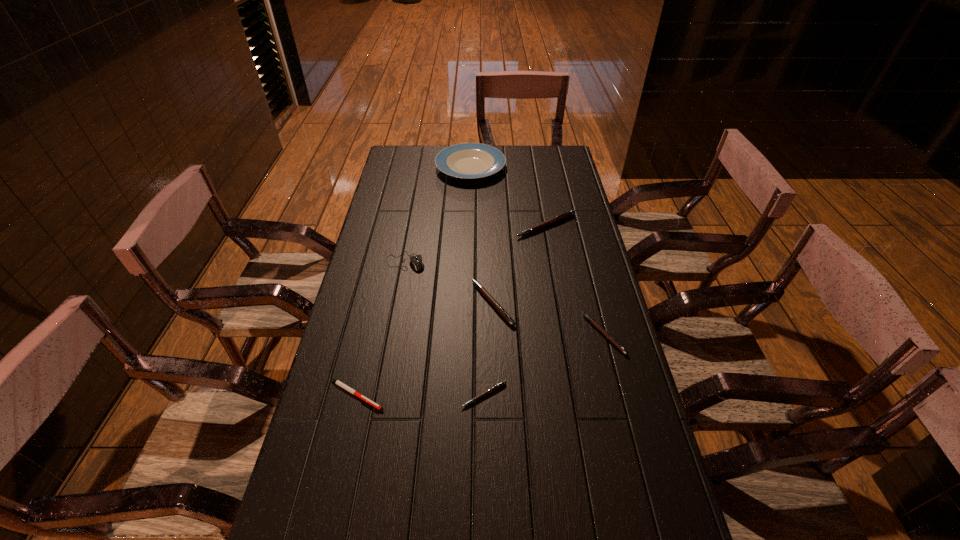
Identify the location of free region located 0.060m at the nib of the smallest pink pen. (484, 432).

The image size is (960, 540). In order to click on vacant space located 0.340m on the clicker of the leftmost pen in this screenshot , I will do `click(520, 395)`.

This screenshot has height=540, width=960. In order to click on object located at the far edge in this screenshot , I will do `click(466, 160)`.

Where is `computer mouse that is at the left edge`? Image resolution: width=960 pixels, height=540 pixels. computer mouse that is at the left edge is located at coordinates (416, 260).

At what (x,y) coordinates should I click in order to perform the action: click on pen that is at the left edge. Please return your answer as a coordinate pair (x, y). The image size is (960, 540). Looking at the image, I should click on (337, 382).

What are the coordinates of `vacant region at the far edge of the desktop` in the screenshot? It's located at (515, 156).

Find the location of a particular element. free space at the left edge of the desktop is located at coordinates (396, 234).

The width and height of the screenshot is (960, 540). Find the location of `free spot at the right edge of the desktop`. free spot at the right edge of the desktop is located at coordinates (592, 272).

At what (x,y) coordinates should I click in order to perform the action: click on vacant area at the far left corner. Please return your answer as a coordinate pair (x, y). This screenshot has height=540, width=960. Looking at the image, I should click on (415, 168).

In order to click on empty space between the white pen and the second biggest pink pen in this screenshot , I will do `click(424, 349)`.